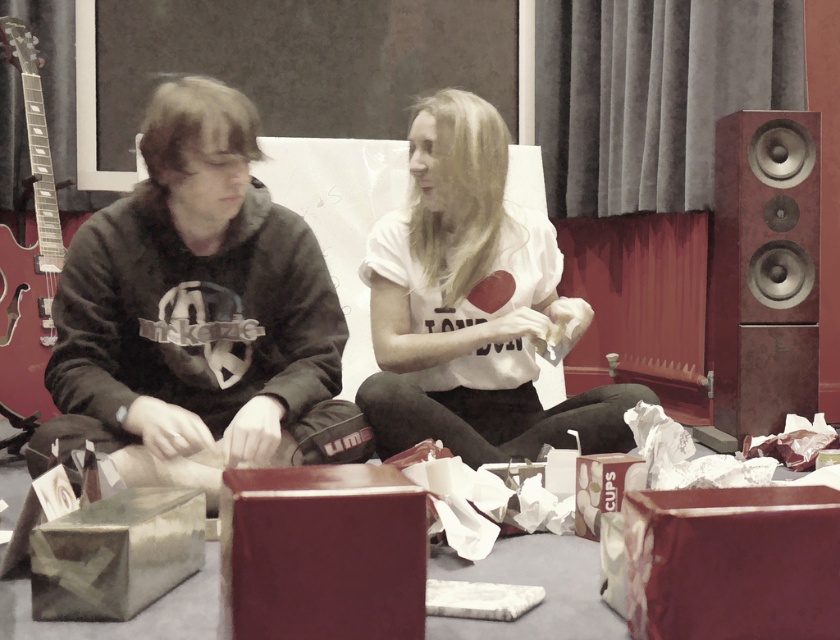
You are standing in the room where the two people are sitting. You want to place a new object exactly where the matte burgundy box at center is currently located. What coordinates should you use?

You should use the coordinates point (x=321, y=554) to place the new object exactly where the matte burgundy box at center is located.

You are a delivery person who just arrived at the scene and need to place a new package on the floor between the shiny maroon box at lower right and the metallic silver box at lower left. Which box should you move to make space?

You should move the metallic silver box at lower left because it is farther away from the viewer than the shiny maroon box at lower right, so moving it closer would create space between them.

You are standing in the room and want to hand a gift to the person wearing the dark gray hoodie at left. Which direction should you walk to approach them?

You should walk towards the left side of the room to approach the person wearing the dark gray hoodie at left since they are located at point (198, 310).